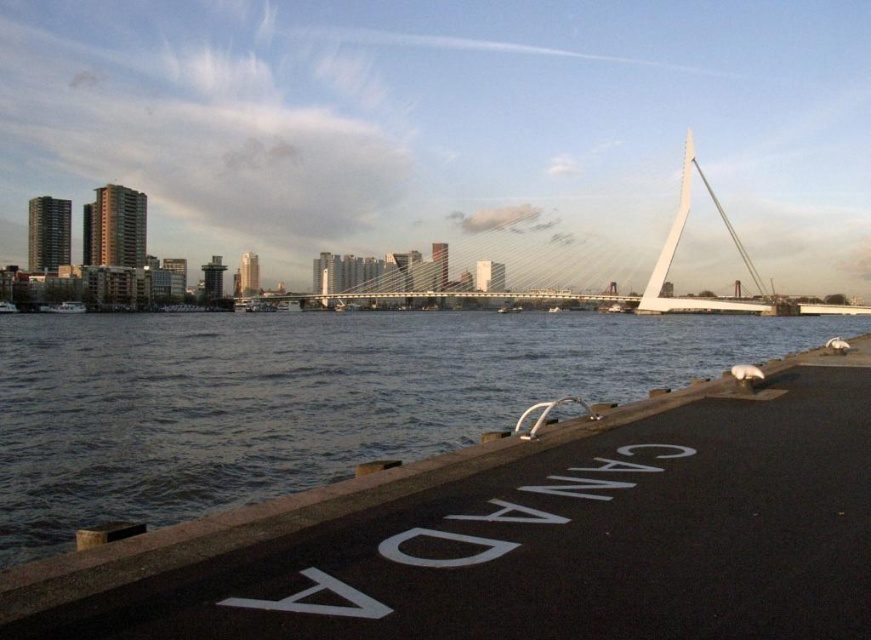
You are standing at the center of the waterfront scene. There is a black asphalt dock at lower right represented by point [525,536]. Can you walk directly to this point from your current position without crossing any obstacles?

The black asphalt dock at lower right is represented by point [525,536]. Since the scene describes a waterfront with a paved area and the dock is part of the paved area, there are no obstacles blocking the path. Therefore, you can walk directly to the point [525,536] without crossing any obstacles.